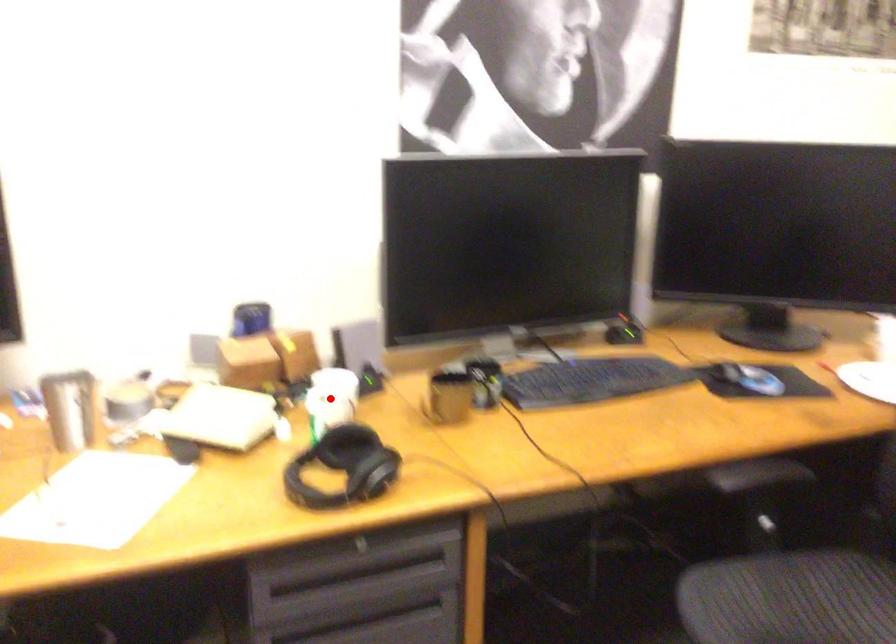
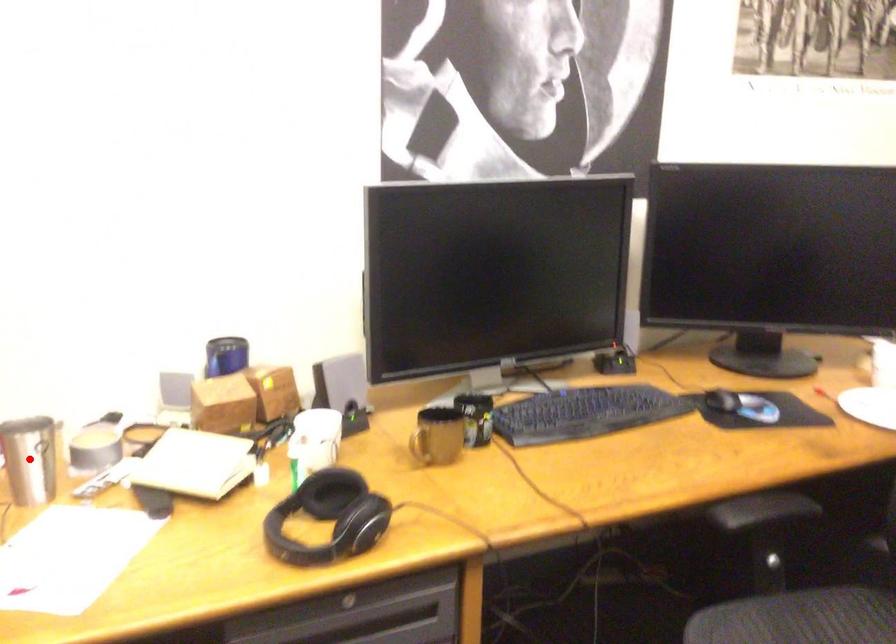
I am providing you with two images of the same scene from different viewpoints. A red point is marked on the first image and another point is marked on the second image. Are the points marked in image1 and image2 representing the same 3D position?

No